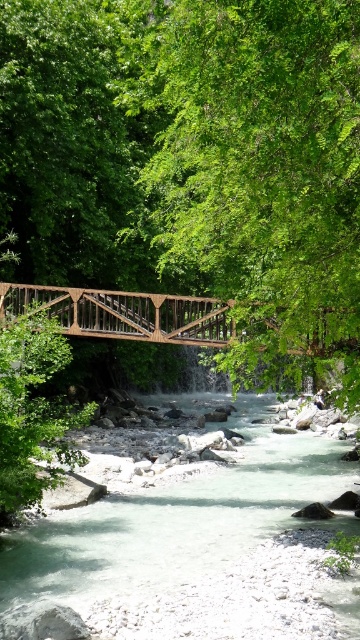
Does point (232, 221) lie in front of point (222, 304)?

Yes.

Is green leafy tree at center below wooden bridge at center?

Incorrect, green leafy tree at center is not positioned below wooden bridge at center.

This screenshot has height=640, width=360. What do you see at coordinates (258, 172) in the screenshot? I see `green leafy tree at center` at bounding box center [258, 172].

Where is `green leafy tree at center`? This screenshot has width=360, height=640. green leafy tree at center is located at coordinates (258, 172).

Which of these two, green leafy tree at center or white smooth river at center, stands shorter?

white smooth river at center

Between point (253, 387) and point (272, 468), which one is positioned behind?

The point (272, 468) is more distant.

Find the location of a particular element. This screenshot has height=640, width=360. green leafy tree at center is located at coordinates (258, 172).

Can you confirm if white smooth river at center is smaller than wooden bridge at center?

No, white smooth river at center is not smaller than wooden bridge at center.

Is white smooth river at center thinner than wooden bridge at center?

No, white smooth river at center is not thinner than wooden bridge at center.

Identify the location of white smooth river at center. (176, 540).

The image size is (360, 640). Identify the location of white smooth river at center. (176, 540).